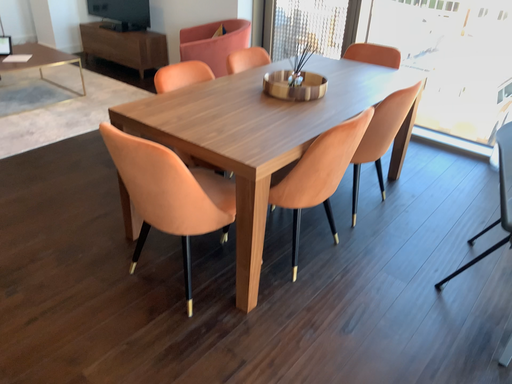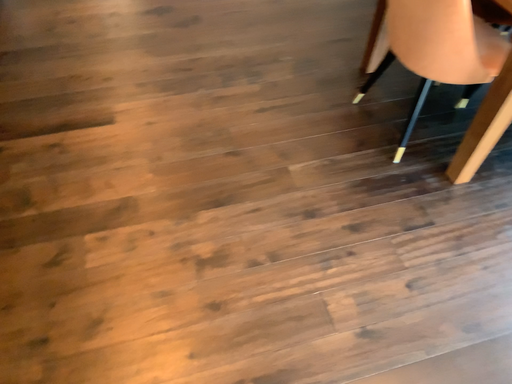
Question: Which way did the camera rotate in the video?

Choices:
 (A) rotated right
 (B) rotated left

Answer: (B)